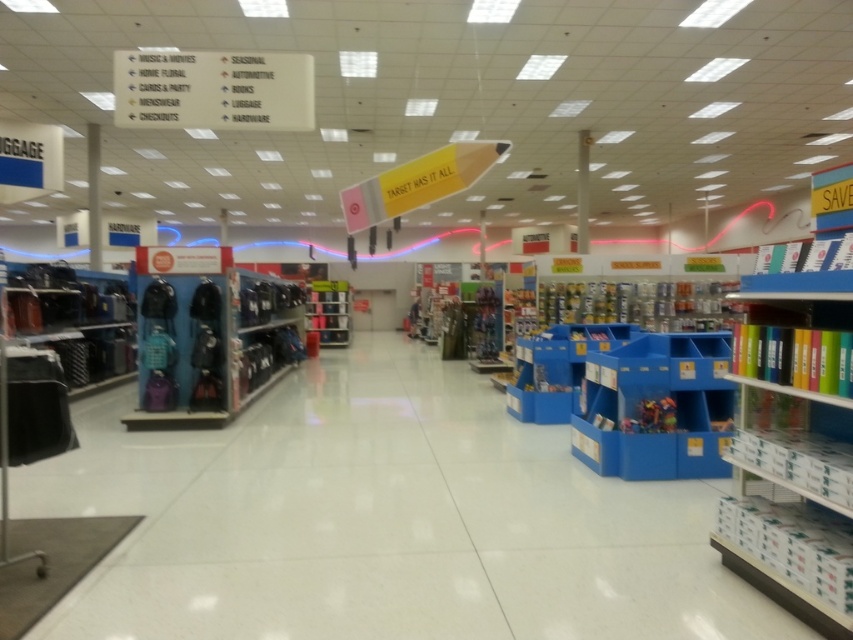
Question: Estimate the real-world distances between objects in this image. Which object is closer to the matte black backpacks at center?

Choices:
 (A) blue plastic bin at center
 (B) matte black luggage at left
 (C) metallic silver shelf at center

Answer: (B)

Question: Which of the following is the farthest from the observer?

Choices:
 (A) metallic silver shelf at center
 (B) matte black backpacks at center
 (C) matte black luggage at left
 (D) blue plastic bin at center

Answer: (A)

Question: Is matte black luggage at left positioned behind metallic silver shelf at center?

Choices:
 (A) no
 (B) yes

Answer: (A)

Question: Does matte black backpacks at center appear over metallic silver shelf at center?

Choices:
 (A) yes
 (B) no

Answer: (B)

Question: Can you confirm if matte black backpacks at center is positioned to the left of blue plastic bin at center?

Choices:
 (A) no
 (B) yes

Answer: (B)

Question: Which object appears farthest from the camera in this image?

Choices:
 (A) metallic silver shelf at center
 (B) matte black backpacks at center
 (C) matte black luggage at left

Answer: (A)